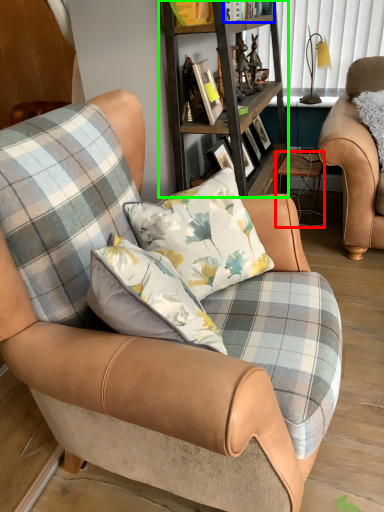
Question: Based on their relative distances, which object is farther from table (highlighted by a red box)? Choose from book (highlighted by a blue box) and shelf (highlighted by a green box).

Choices:
 (A) book
 (B) shelf

Answer: (A)